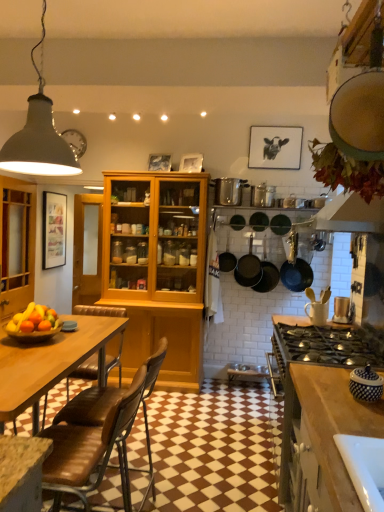
Image resolution: width=384 pixels, height=512 pixels. What do you see at coordinates (320, 413) in the screenshot?
I see `white wood countertop at right` at bounding box center [320, 413].

Find the location of a particular element. wooden bowl at lower left is located at coordinates (33, 335).

Locate an element on the screen. This screenshot has width=384, height=512. matte black frying pan at center, which is the first frying pan from right to left is located at coordinates (259, 221).

In order to face black matte pans at center, arranged as the 2th kitchen appliance when viewed from the right, should I rotate leftwards or rightwards?

You should rotate right by 10.165 degrees.

Identify the location of white wood countertop at right. This screenshot has height=512, width=384. (320, 413).

Does silver metallic pot at center, placed as the 1th appliance when sorted from left to right, turn towards matte black pan at upper right, which is the 3th kitchen appliance in left-to-right order?

No, silver metallic pot at center, placed as the 1th appliance when sorted from left to right, is not aimed at matte black pan at upper right, which is the 3th kitchen appliance in left-to-right order.

Is the position of silver metallic pot at center, the 1th appliance viewed from the top, less distant than that of matte black pan at upper right, which is the 3th kitchen appliance in left-to-right order?

Yes, silver metallic pot at center, the 1th appliance viewed from the top, is closer to the viewer.

Which of these two, silver metallic pot at center, arranged as the 3th appliance when ordered from the bottom, or matte black pan at upper right, which is the 3th kitchen appliance in left-to-right order, stands shorter?

silver metallic pot at center, arranged as the 3th appliance when ordered from the bottom, is shorter.

From the image's perspective, which is below, silver metallic pot at center, the third appliance positioned from the right, or matte black pan at upper right, arranged as the 1th kitchen appliance when viewed from the right?

matte black pan at upper right, arranged as the 1th kitchen appliance when viewed from the right, appears lower in the image.

Based on the photo, measure the distance from white textured jar at lower right, which ranks as the first appliance in bottom-to-top order, to matte gray lampshade at upper left.

A distance of 5.63 feet exists between white textured jar at lower right, which ranks as the first appliance in bottom-to-top order, and matte gray lampshade at upper left.

From the picture: From the image's perspective, is white textured jar at lower right, placed as the first appliance when sorted from front to back, over matte gray lampshade at upper left?

Incorrect, from the image's perspective, white textured jar at lower right, placed as the first appliance when sorted from front to back, is lower than matte gray lampshade at upper left.

Considering the relative sizes of white textured jar at lower right, the third appliance when ordered from back to front, and matte gray lampshade at upper left in the image provided, is white textured jar at lower right, the third appliance when ordered from back to front, shorter than matte gray lampshade at upper left?

Correct, white textured jar at lower right, the third appliance when ordered from back to front, is not as tall as matte gray lampshade at upper left.

Are white textured jar at lower right, which ranks as the first appliance in bottom-to-top order, and matte gray lampshade at upper left making contact?

No, white textured jar at lower right, which ranks as the first appliance in bottom-to-top order, is not in contact with matte gray lampshade at upper left.

Is point (242, 218) positioned in front of point (336, 304)?

No, (242, 218) is further to viewer.

In the scene shown: Is matte black frying pan at center, the 1th frying pan positioned from the left, next to metallic silver toaster at right, which appears as the third appliance when viewed from the left?

No, matte black frying pan at center, the 1th frying pan positioned from the left, is not next to metallic silver toaster at right, which appears as the third appliance when viewed from the left.

Consider the image. Considering the sizes of matte black frying pan at center, which is the 2th frying pan from right to left, and metallic silver toaster at right, which appears as the second appliance when viewed from the top, in the image, is matte black frying pan at center, which is the 2th frying pan from right to left, taller or shorter than metallic silver toaster at right, which appears as the second appliance when viewed from the top,?

Considering their sizes, matte black frying pan at center, which is the 2th frying pan from right to left, has less height than metallic silver toaster at right, which appears as the second appliance when viewed from the top.

Measure the distance from matte black frying pan at center, which is the 2th frying pan from right to left, to metallic silver toaster at right, which appears as the third appliance when viewed from the left.

The distance of matte black frying pan at center, which is the 2th frying pan from right to left, from metallic silver toaster at right, which appears as the third appliance when viewed from the left, is 1.41 meters.

Which is behind, point (240, 274) or point (251, 221)?

The point (251, 221) is farther from the camera.

From a real-world perspective, between matte black pans at center, marked as the first kitchen appliance in a left-to-right arrangement, and matte black frying pan at center, which is the first frying pan from right to left, who is vertically lower?

matte black pans at center, marked as the first kitchen appliance in a left-to-right arrangement, from a real-world perspective.

In the scene shown: Who is more distant, matte black pans at center, marked as the first kitchen appliance in a left-to-right arrangement, or matte black frying pan at center, marked as the second frying pan in a left-to-right arrangement?

matte black frying pan at center, marked as the second frying pan in a left-to-right arrangement, is behind.

In the scene shown: Can you confirm if matte black pans at center, marked as the first kitchen appliance in a left-to-right arrangement, is taller than matte black frying pan at center, marked as the second frying pan in a left-to-right arrangement?

Yes.

Between matte gray lampshade at upper left and silver metallic pot at center, the 1th appliance viewed from the top, which one is positioned in front?

matte gray lampshade at upper left.

From the image's perspective, which object appears higher, matte gray lampshade at upper left or silver metallic pot at center, the 1th appliance viewed from the top?

matte gray lampshade at upper left appears higher in the image.

What's the angular difference between matte gray lampshade at upper left and silver metallic pot at center, arranged as the 3th appliance when ordered from the bottom,'s facing directions?

The facing directions of matte gray lampshade at upper left and silver metallic pot at center, arranged as the 3th appliance when ordered from the bottom, are 1.34 degrees apart.

Is matte gray lampshade at upper left taller or shorter than silver metallic pot at center, the third appliance positioned from the front?

In the image, matte gray lampshade at upper left appears to be taller than silver metallic pot at center, the third appliance positioned from the front.

Is matte black pans at center, marked as the first kitchen appliance in a left-to-right arrangement, inside or outside of metallic silver toaster at right, the second appliance in the back-to-front sequence?

matte black pans at center, marked as the first kitchen appliance in a left-to-right arrangement, is outside metallic silver toaster at right, the second appliance in the back-to-front sequence.

In terms of height, does matte black pans at center, which is the 3th kitchen appliance in right-to-left order, look taller or shorter compared to metallic silver toaster at right, the second appliance in the back-to-front sequence?

matte black pans at center, which is the 3th kitchen appliance in right-to-left order, is taller than metallic silver toaster at right, the second appliance in the back-to-front sequence.

From the image's perspective, is matte black pans at center, which is the 3th kitchen appliance in right-to-left order, located above or below metallic silver toaster at right, which appears as the second appliance when viewed from the top?

Result: Based on their image positions, matte black pans at center, which is the 3th kitchen appliance in right-to-left order, is located above metallic silver toaster at right, which appears as the second appliance when viewed from the top.

Who is shorter, matte black frying pan at center, which is the first frying pan from right to left, or black matte pans at center, arranged as the 2th kitchen appliance when viewed from the right?

matte black frying pan at center, which is the first frying pan from right to left.

From a real-world perspective, is matte black frying pan at center, marked as the second frying pan in a left-to-right arrangement, physically above black matte pans at center, arranged as the 2th kitchen appliance when viewed from the right?

Yes, from a real-world perspective, matte black frying pan at center, marked as the second frying pan in a left-to-right arrangement, is on top of black matte pans at center, arranged as the 2th kitchen appliance when viewed from the right.

Based on the photo, is matte black frying pan at center, marked as the second frying pan in a left-to-right arrangement, smaller than black matte pans at center, arranged as the 2th kitchen appliance when viewed from the right?

Correct, matte black frying pan at center, marked as the second frying pan in a left-to-right arrangement, occupies less space than black matte pans at center, arranged as the 2th kitchen appliance when viewed from the right.

Locate an element on the screen. This screenshot has height=512, width=384. the 3rd kitchen appliance below the silver metallic pot at center, the third appliance positioned from the front (from the image's perspective) is located at coordinates (295, 268).

The height and width of the screenshot is (512, 384). Find the location of `light fixture behind the white textured jar at lower right, placed as the first appliance when sorted from front to back`. light fixture behind the white textured jar at lower right, placed as the first appliance when sorted from front to back is located at coordinates (39, 136).

Estimate the real-world distances between objects in this image. Which object is further from metallic silver toaster at right, acting as the second appliance starting from the front, black matte pans at center, arranged as the 2th kitchen appliance when viewed from the right, or wooden cabinet at left?

Based on the image, wooden cabinet at left appears to be further to metallic silver toaster at right, acting as the second appliance starting from the front.

Considering their positions, is brown leather chair at lower left positioned closer to wooden bowl at lower left than white wood countertop at right?

The object closer to wooden bowl at lower left is brown leather chair at lower left.

When comparing their distances from wooden bowl at lower left, does black matte pans at center, placed as the 2th kitchen appliance when sorted from left to right, or white textured jar at lower right, which ranks as the first appliance in bottom-to-top order, seem further?

black matte pans at center, placed as the 2th kitchen appliance when sorted from left to right, is further to wooden bowl at lower left.

Estimate the real-world distances between objects in this image. Which object is further from matte black pan at upper right, arranged as the 1th kitchen appliance when viewed from the right, wooden cabinet at left or brown leather chair at lower left?

wooden cabinet at left lies further to matte black pan at upper right, arranged as the 1th kitchen appliance when viewed from the right, than the other object.

Based on their spatial positions, is matte black pan at upper right, arranged as the 1th kitchen appliance when viewed from the right, or matte black frying pan at center, marked as the second frying pan in a left-to-right arrangement, further from metallic silver toaster at right, acting as the second appliance starting from the front?

The object further to metallic silver toaster at right, acting as the second appliance starting from the front, is matte black frying pan at center, marked as the second frying pan in a left-to-right arrangement.

Which object lies further to the anchor point black matte pans at center, arranged as the 2th kitchen appliance when viewed from the right, matte black frying pan at center, which is the first frying pan from right to left, or matte black pans at center, marked as the first kitchen appliance in a left-to-right arrangement?

matte black frying pan at center, which is the first frying pan from right to left, is positioned further to the anchor black matte pans at center, arranged as the 2th kitchen appliance when viewed from the right.

Estimate the real-world distances between objects in this image. Which object is further from brown leather chair at lower left, metallic silver toaster at right, which appears as the second appliance when viewed from the top, or matte black pan at upper right, arranged as the 1th kitchen appliance when viewed from the right?

matte black pan at upper right, arranged as the 1th kitchen appliance when viewed from the right, is positioned further to the anchor brown leather chair at lower left.

Estimate the real-world distances between objects in this image. Which object is closer to white wood countertop at right, matte black pans at center, which is the 3th kitchen appliance in right-to-left order, or metallic silver toaster at right, acting as the second appliance starting from the front?

Among the two, metallic silver toaster at right, acting as the second appliance starting from the front, is located nearer to white wood countertop at right.

This screenshot has height=512, width=384. Find the location of `frying pan located between white textured jar at lower right, placed as the first appliance when sorted from front to back, and matte black frying pan at center, the 1th frying pan positioned from the left, in the depth direction`. frying pan located between white textured jar at lower right, placed as the first appliance when sorted from front to back, and matte black frying pan at center, the 1th frying pan positioned from the left, in the depth direction is located at coordinates (259, 221).

At what (x,y) coordinates should I click in order to perform the action: click on appliance between matte gray lampshade at upper left and silver metallic pot at center, the 1th appliance viewed from the top, from front to back. Please return your answer as a coordinate pair (x, y). Looking at the image, I should click on (342, 310).

Locate an element on the screen. This screenshot has width=384, height=512. chair located between white wood countertop at right and matte black frying pan at center, which is the first frying pan from right to left, in the depth direction is located at coordinates (89, 407).

Find the location of a particular element. cabinetry between white wood countertop at right and silver metallic pot at center, arranged as the 3th appliance when ordered from the bottom, in the front-back direction is located at coordinates (16, 245).